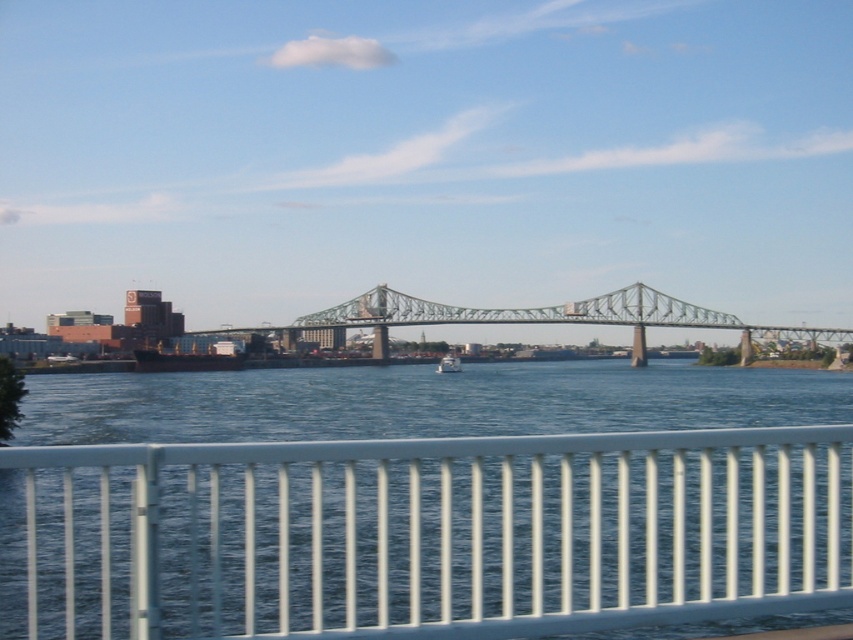
From the picture: You are standing at the point marked as point 0.689, 0.999 and want to reach the point marked as point (509, 440). The bridge is 7.23 meters long. If you walk straight towards the latter point, will you be able to reach it without crossing the bridge?

The distance between the two points is 7.23 meters. Since the bridge is 7.23 meters long and you are walking straight towards the desired point, you will be able to reach it by walking across the bridge.

You are standing at the white metal railing overlooking the river and bridge. You notice two points marked in the scene. Which point is closer to you, point (375, 314) or point (442, 371)?

Point (375, 314) is closer to you because it is further to the viewer than point (442, 371).

You are a painter who wants to paint both the white metal railing at lower center and the green metallic bridge at center. Which object requires more paint in terms of width?

The green metallic bridge at center requires more paint in terms of width because it has a greater width than the white metal railing at lower center.